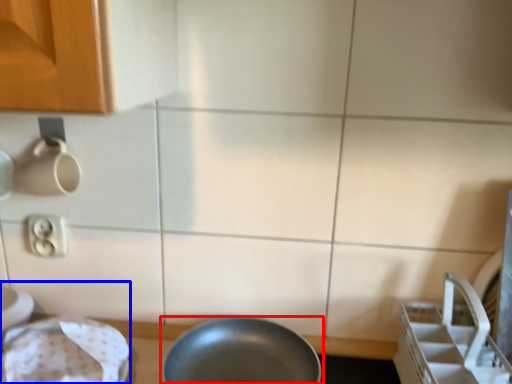
Question: Which point is closer to the camera, frying pan (highlighted by a red box) or sink (highlighted by a blue box)?

Choices:
 (A) frying pan
 (B) sink

Answer: (B)